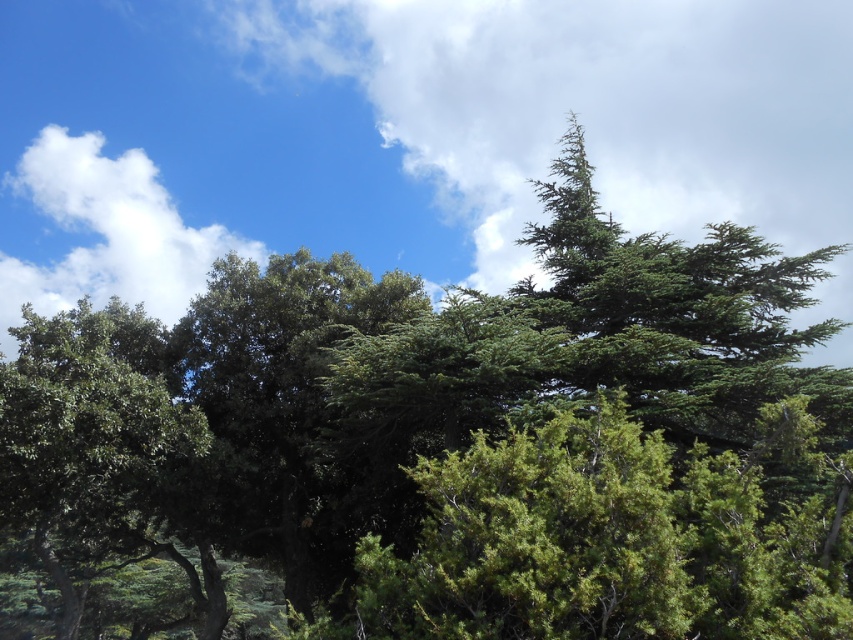
Does green matte tree at left have a lesser height compared to white fluffy cloud at upper left?

Correct, green matte tree at left is not as tall as white fluffy cloud at upper left.

Is point (57, 481) positioned after point (22, 280)?

No, (57, 481) is in front of (22, 280).

Is point (187, 515) behind point (15, 280)?

No, it is not.

You are a GUI agent. You are given a task and a screenshot of the screen. Output one action in this format:
    pyautogui.click(x=<x>, y=<y>)
    Task: Click on the green matte tree at left
    This screenshot has height=640, width=853.
    Given the screenshot: What is the action you would take?
    pyautogui.click(x=103, y=458)